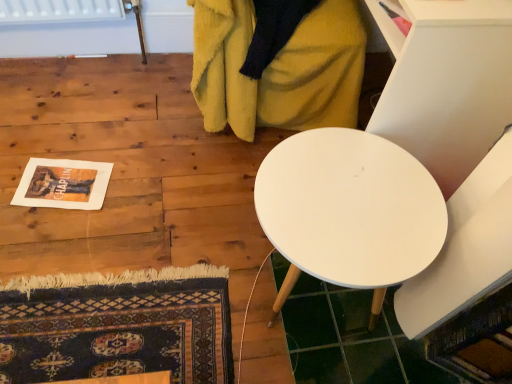
Identify the location of vacant area that is in front of soft yellow blanket at upper center. (182, 192).